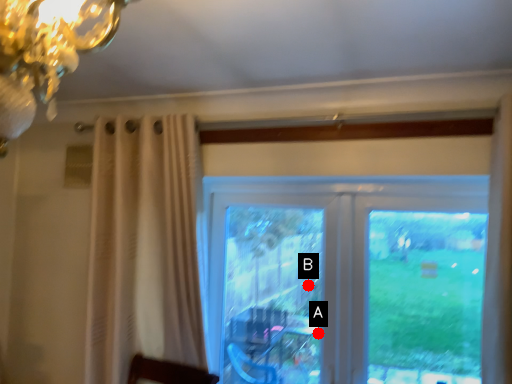
Question: Two points are circled on the image, labeled by A and B beside each circle. Which point is closer to the camera?

Choices:
 (A) A is closer
 (B) B is closer

Answer: (A)